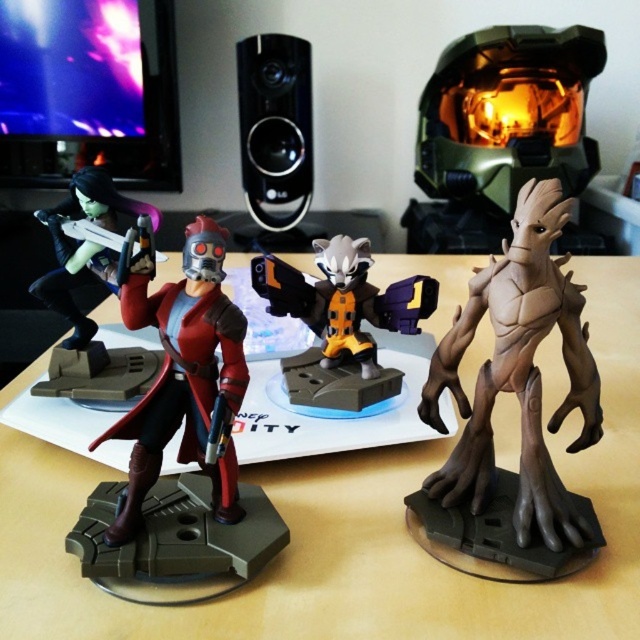
Question: Can you confirm if glossy plastic helmet at upper center is positioned above matte black figure at left?

Choices:
 (A) yes
 (B) no

Answer: (A)

Question: Which object is the farthest from the glossy plastic figure at center?

Choices:
 (A) brown matte tree-like figure at right
 (B) glossy plastic helmet at upper center
 (C) matte black figure at left

Answer: (B)

Question: Which object is closer to the camera taking this photo?

Choices:
 (A) matte red plastic figure at center
 (B) glossy plastic figure at center

Answer: (A)

Question: Does light brown wood table at center have a greater width compared to matte red plastic figure at center?

Choices:
 (A) yes
 (B) no

Answer: (A)

Question: Is light brown wood table at center to the right of black plastic speaker at upper center from the viewer's perspective?

Choices:
 (A) yes
 (B) no

Answer: (A)

Question: Which point is farther from the camera taking this photo?

Choices:
 (A) (577, 381)
 (B) (67, 307)
 (C) (266, 106)

Answer: (C)